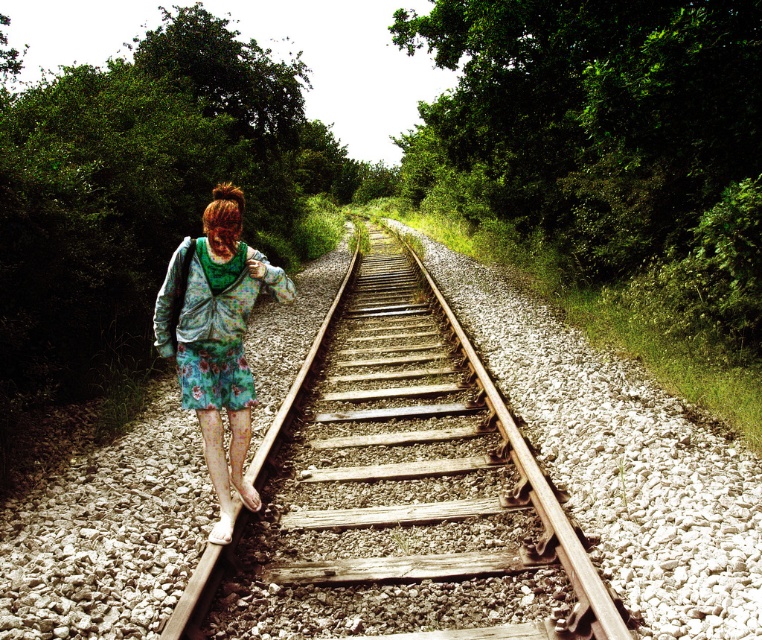
You are a photographer wanting to capture the wooden track at center and the floral fabric skirt at center in a single shot. Which object appears taller in the photo?

The floral fabric skirt at center appears taller than the wooden track at center in the photo.

You are a fashion designer observing a model wearing both the floral fabric skirt at center and the floral fabric dress at center. Which piece of clothing would you recommend for a design that requires a more voluminous silhouette?

The floral fabric skirt at center is larger in size than the floral fabric dress at center, so it would be better suited for a design requiring a more voluminous silhouette.

You are a photographer trying to capture the person walking along the railway tracks. You notice both the floral fabric skirt at center and the floral fabric dress at center. Which one is closer to the camera based on their positions?

The floral fabric skirt at center is closer to the camera because it is in front of the floral fabric dress at center.